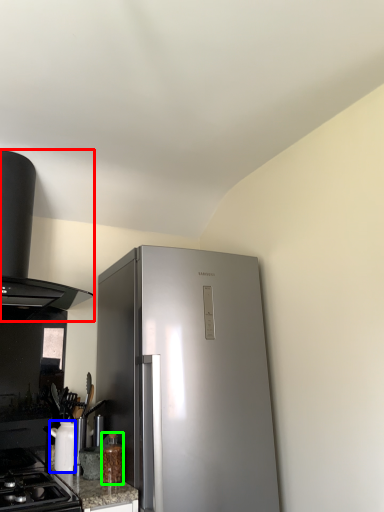
Question: Based on their relative distances, which object is nearer to kitchen appliance (highlighted by a red box)? Choose from appliance (highlighted by a blue box) and bottle (highlighted by a green box).

Choices:
 (A) appliance
 (B) bottle

Answer: (A)